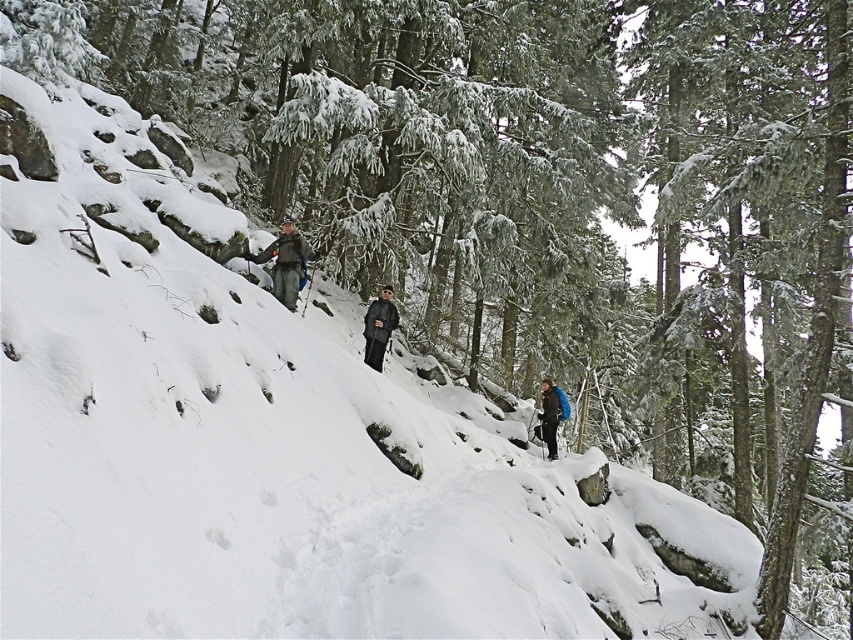
You are an outdoor enthusiast planning to carry both the camouflage jacket at center and the blue fabric backpack at right. Based on their sizes, which item should you place first in your storage area to optimize space?

The camouflage jacket at center occupies less space than the blue fabric backpack at right, so you should place the blue fabric backpack at right first to optimize space.